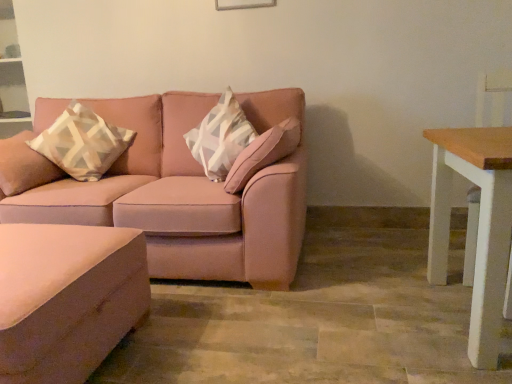
In order to face wooden white table at right, should I rotate leftwards or rightwards?

Rotate your view right by about 29.865°.

What are the coordinates of `matte pink ottoman at lower left` in the screenshot? It's located at (67, 298).

Image resolution: width=512 pixels, height=384 pixels. What are the coordinates of `matte pink couch at center` in the screenshot? It's located at (167, 195).

The image size is (512, 384). Describe the element at coordinates (82, 143) in the screenshot. I see `beige-patterned cushion at left` at that location.

The width and height of the screenshot is (512, 384). I want to click on wooden white table at right, so click(x=479, y=225).

From the image's perspective, relative to matte pink ottoman at lower left, is matte pink couch at center above or below?

matte pink couch at center is situated higher than matte pink ottoman at lower left in the image.

Find the location of `footrest below the matte pink couch at center (from the image's perspective)`. footrest below the matte pink couch at center (from the image's perspective) is located at coordinates (67, 298).

Which object is closer to the camera taking this photo, matte pink couch at center or matte pink ottoman at lower left?

matte pink ottoman at lower left is closer to the camera.

Are matte pink couch at center and matte pink ottoman at lower left located far from each other?

No, matte pink couch at center is not far away from matte pink ottoman at lower left.

Which object is thinner, matte pink ottoman at lower left or wooden white table at right?

With smaller width is wooden white table at right.

Can you confirm if matte pink ottoman at lower left is taller than wooden white table at right?

In fact, matte pink ottoman at lower left may be shorter than wooden white table at right.

In the scene shown: Can you confirm if matte pink couch at center is smaller than beige-patterned cushion at left?

Incorrect, matte pink couch at center is not smaller in size than beige-patterned cushion at left.

Which object is positioned more to the right, matte pink couch at center or beige-patterned cushion at left?

From the viewer's perspective, matte pink couch at center appears more on the right side.

Are matte pink couch at center and beige-patterned cushion at left located far from each other?

No, matte pink couch at center is in close proximity to beige-patterned cushion at left.

Considering the sizes of objects matte pink couch at center and beige-patterned cushion at left in the image provided, who is shorter, matte pink couch at center or beige-patterned cushion at left?

beige-patterned cushion at left.

From the image's perspective, is wooden white table at right below matte pink couch at center?

Yes.

From a real-world perspective, relative to matte pink couch at center, is wooden white table at right vertically above or below?

From a real-world perspective, wooden white table at right is physically below matte pink couch at center.

Is wooden white table at right looking in the opposite direction of matte pink couch at center?

No, wooden white table at right is not facing the opposite direction of matte pink couch at center.

Consider the image. Is beige-patterned cushion at left with matte pink couch at center?

No, beige-patterned cushion at left is not in contact with matte pink couch at center.

From a real-world perspective, between beige-patterned cushion at left and matte pink couch at center, who is vertically higher?

From a 3D spatial view, beige-patterned cushion at left is above.

Can you confirm if beige-patterned cushion at left is positioned to the right of matte pink couch at center?

No.

How distant is beige-patterned cushion at left from matte pink couch at center?

beige-patterned cushion at left and matte pink couch at center are 15.05 inches apart from each other.

Is wooden white table at right in contact with matte pink ottoman at lower left?

No, wooden white table at right is not beside matte pink ottoman at lower left.

From the image's perspective, is wooden white table at right under matte pink ottoman at lower left?

Actually, wooden white table at right appears above matte pink ottoman at lower left in the image.

Between wooden white table at right and matte pink ottoman at lower left, which one has more height?

With more height is wooden white table at right.

Can you confirm if wooden white table at right is wider than matte pink ottoman at lower left?

No.

Is matte pink ottoman at lower left aimed at matte pink couch at center?

No, matte pink ottoman at lower left is not turned towards matte pink couch at center.

Is matte pink ottoman at lower left completely or partially outside of matte pink couch at center?

Yes, matte pink ottoman at lower left is not within matte pink couch at center.

Does matte pink ottoman at lower left have a greater width compared to matte pink couch at center?

In fact, matte pink ottoman at lower left might be narrower than matte pink couch at center.

This screenshot has width=512, height=384. There is a matte pink ottoman at lower left. What are the coordinates of `studio couch above it (from a real-world perspective)` in the screenshot? It's located at (167, 195).

At what (x,y) coordinates should I click in order to perform the action: click on table on the right of matte pink ottoman at lower left. Please return your answer as a coordinate pair (x, y). Looking at the image, I should click on (479, 225).

Estimate the real-world distances between objects in this image. Which object is further from matte pink couch at center, matte pink ottoman at lower left or wooden white table at right?

wooden white table at right lies further to matte pink couch at center than the other object.

Consider the image. Estimate the real-world distances between objects in this image. Which object is closer to wooden white table at right, matte pink ottoman at lower left or matte pink couch at center?

Based on the image, matte pink couch at center appears to be nearer to wooden white table at right.

When comparing their distances from matte pink ottoman at lower left, does matte pink couch at center or wooden white table at right seem closer?

matte pink couch at center is positioned closer to the anchor matte pink ottoman at lower left.

Estimate the real-world distances between objects in this image. Which object is closer to wooden white table at right, matte pink ottoman at lower left or beige-patterned cushion at left?

Among the two, matte pink ottoman at lower left is located nearer to wooden white table at right.

From the image, which object appears to be farther from beige-patterned cushion at left, matte pink couch at center or matte pink ottoman at lower left?

matte pink ottoman at lower left lies further to beige-patterned cushion at left than the other object.

Looking at the image, which one is located further to matte pink ottoman at lower left, wooden white table at right or beige-patterned cushion at left?

Based on the image, wooden white table at right appears to be further to matte pink ottoman at lower left.

Based on their spatial positions, is matte pink ottoman at lower left or beige-patterned cushion at left further from matte pink couch at center?

Based on the image, matte pink ottoman at lower left appears to be further to matte pink couch at center.

From the image, which object appears to be farther from wooden white table at right, beige-patterned cushion at left or matte pink couch at center?

beige-patterned cushion at left is positioned further to the anchor wooden white table at right.

The image size is (512, 384). What are the coordinates of `the footrest located between beige-patterned cushion at left and wooden white table at right in the left-right direction` in the screenshot? It's located at (67, 298).

Find the location of a particular element. The height and width of the screenshot is (384, 512). studio couch between beige-patterned cushion at left and wooden white table at right from left to right is located at coordinates (167, 195).

Where is `studio couch between matte pink ottoman at lower left and wooden white table at right from left to right`? studio couch between matte pink ottoman at lower left and wooden white table at right from left to right is located at coordinates (167, 195).

Identify the location of studio couch between matte pink ottoman at lower left and beige-patterned cushion at left in the front-back direction. This screenshot has width=512, height=384. (167, 195).